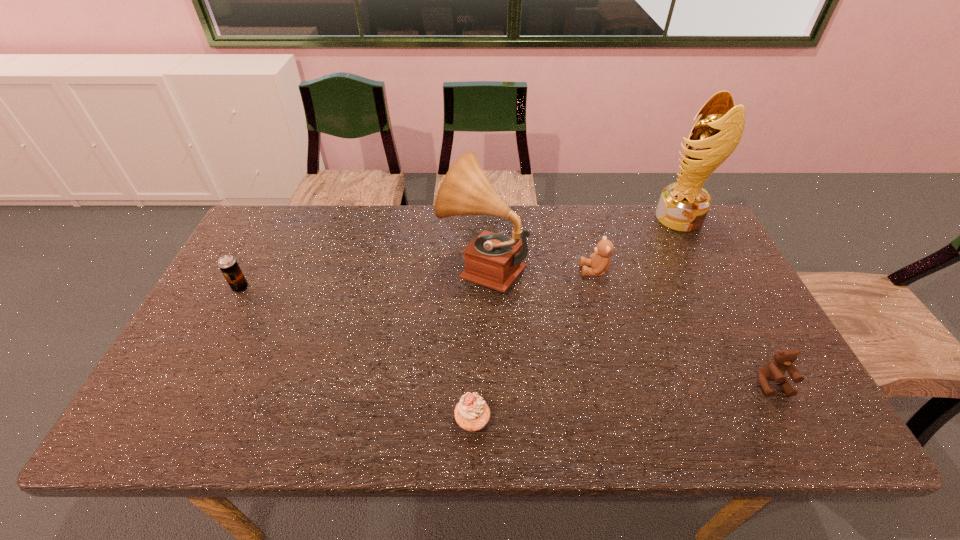
Find the location of `vacant space in between the nearer teddy bear and the tallest object`. vacant space in between the nearer teddy bear and the tallest object is located at coordinates (726, 301).

This screenshot has height=540, width=960. I want to click on vacant region between the tallest object and the beer can, so click(x=460, y=253).

Find the location of a particular element. empty space between the leftmost object and the shortest object is located at coordinates 356,354.

The height and width of the screenshot is (540, 960). I want to click on vacant point located between the right teddy bear and the third object from right to left, so click(684, 327).

The image size is (960, 540). In order to click on free space between the nearer teddy bear and the leftmost object in this screenshot , I will do `click(506, 336)`.

Locate which object is the second closest to the award. Please provide its 2D coordinates. Your answer should be formatted as a tuple, i.e. [(x, y)], where the tuple contains the x and y coordinates of a point satisfying the conditions above.

[(492, 260)]

Identify which object is located as the nearest to the right teddy bear. Please provide its 2D coordinates. Your answer should be formatted as a tuple, i.e. [(x, y)], where the tuple contains the x and y coordinates of a point satisfying the conditions above.

[(599, 261)]

Locate an element on the screen. vacant area in the image that satisfies the following two spatial constraints: 1. on the front-facing side of the award; 2. on the front side of the leftmost object is located at coordinates (715, 288).